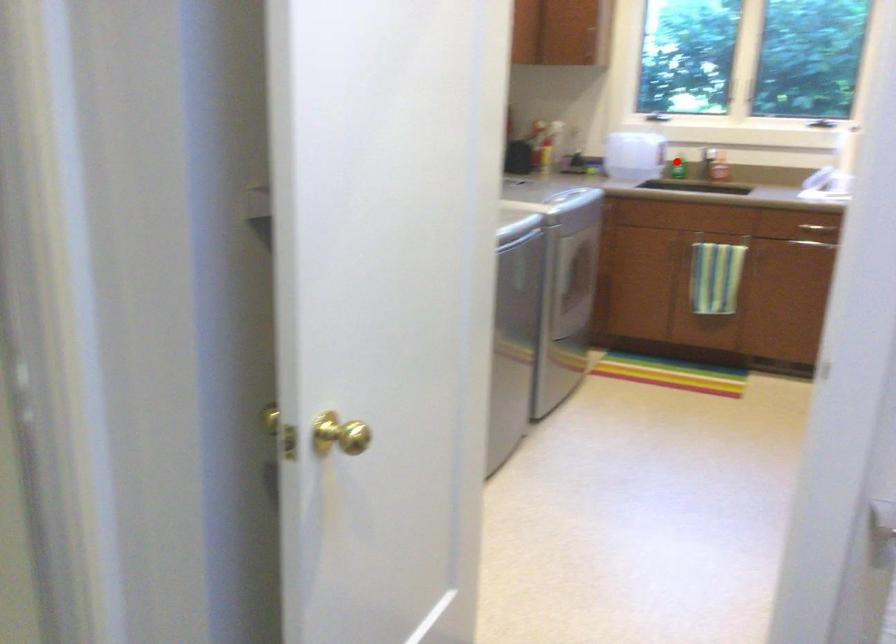
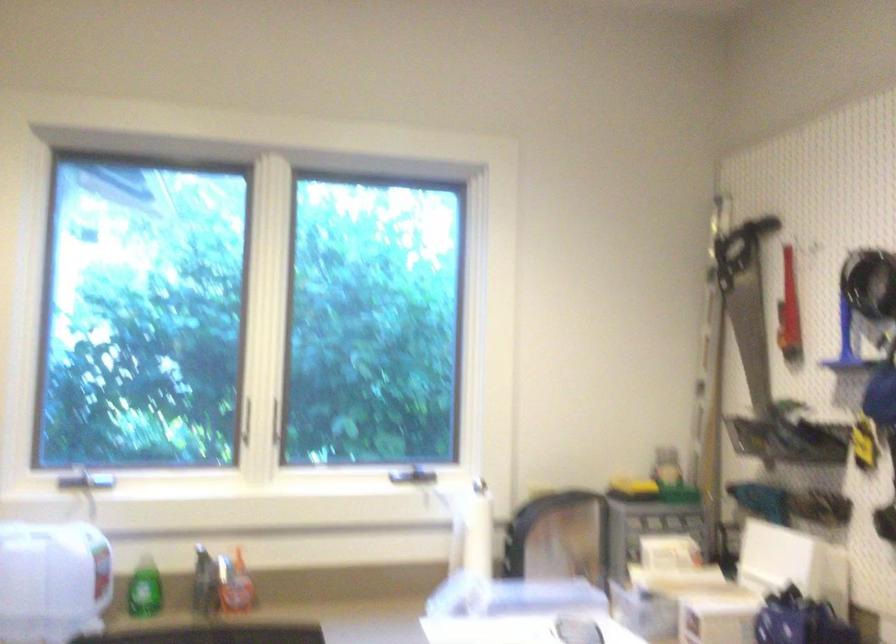
Question: I am providing you with two images of the same scene from different viewpoints. A red point is shown in image1. For the corresponding object point in image2, is it positioned nearer or farther from the camera?

Choices:
 (A) Nearer
 (B) Farther

Answer: (A)